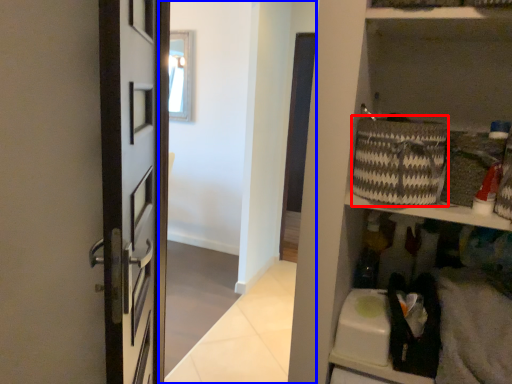
Question: Which object is further to the camera taking this photo, basket (highlighted by a red box) or corridor (highlighted by a blue box)?

Choices:
 (A) basket
 (B) corridor

Answer: (B)